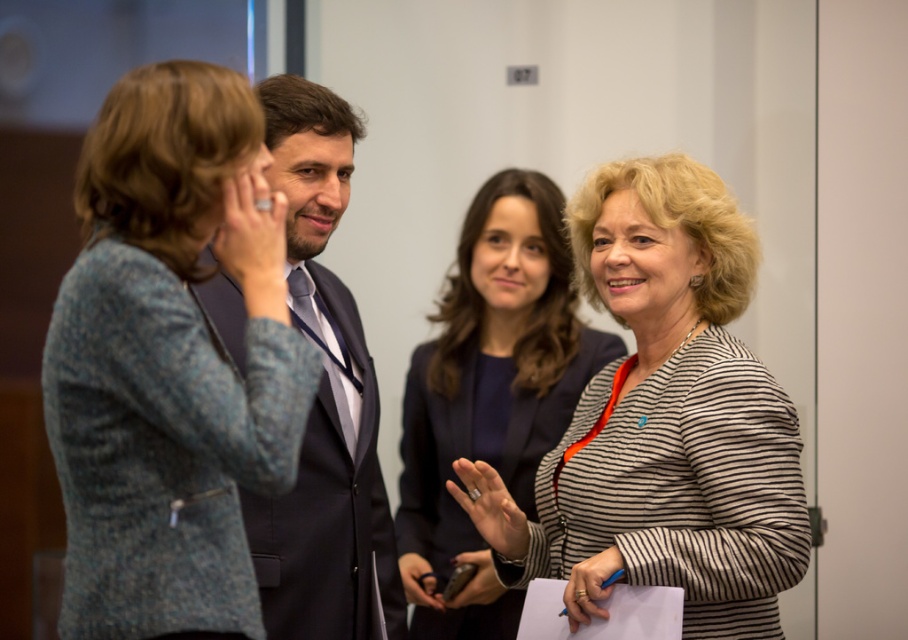
Question: Is textured gray blazer at left in front of dark gray suit at center?

Choices:
 (A) yes
 (B) no

Answer: (A)

Question: Which point appears farthest from the camera in this image?

Choices:
 (A) (102, 600)
 (B) (544, 301)
 (C) (270, 93)

Answer: (B)

Question: Can you confirm if striped fabric jacket at center is positioned to the left of dark gray suit at center?

Choices:
 (A) yes
 (B) no

Answer: (B)

Question: Among these points, which one is nearest to the camera?

Choices:
 (A) click(709, 230)
 (B) click(553, 241)
 (C) click(291, 627)

Answer: (C)

Question: Is textured gray blazer at left to the left of dark gray suit at center from the viewer's perspective?

Choices:
 (A) yes
 (B) no

Answer: (A)

Question: Which of the following is the closest to the observer?

Choices:
 (A) textured gray blazer at left
 (B) striped fabric jacket at center
 (C) dark gray suit at center
 (D) striped fabric at center

Answer: (A)